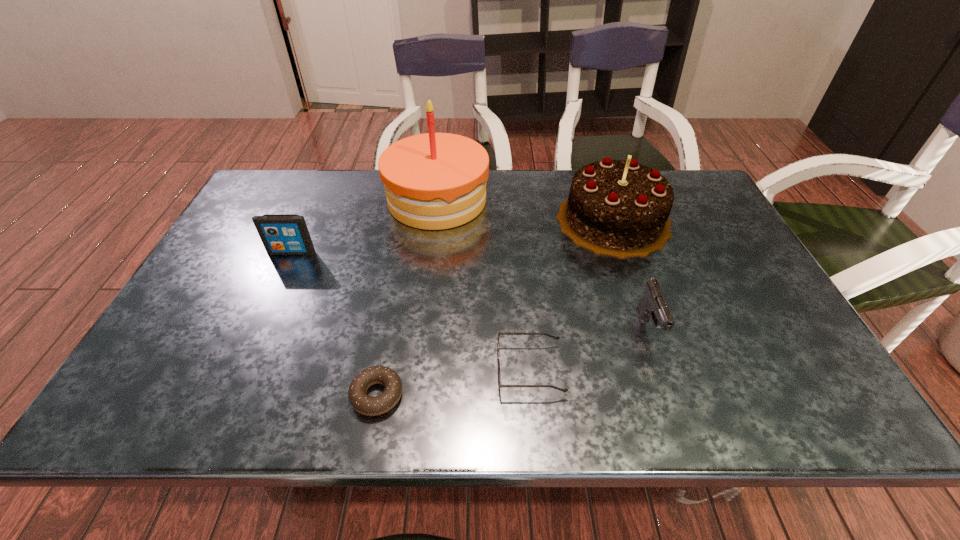
Find the location of a particular element. This screenshot has height=540, width=960. the fourth closest object to the right birthday cake is located at coordinates (371, 406).

Where is `vacant space that satisfies the following two spatial constraints: 1. at the barrel of the pistol; 2. on the front lenses of the sunglasses`? vacant space that satisfies the following two spatial constraints: 1. at the barrel of the pistol; 2. on the front lenses of the sunglasses is located at coordinates (664, 369).